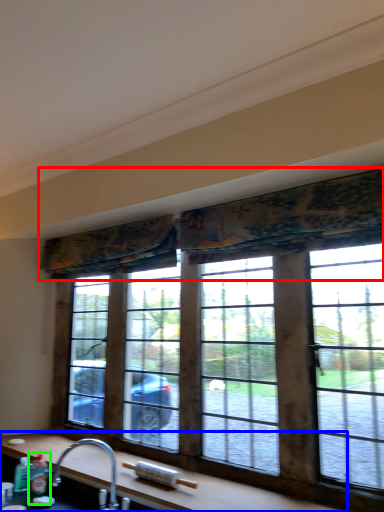
Question: Which object is the farthest from curtain (highlighted by a red box)? Choose among these: counter top (highlighted by a blue box) or bottle (highlighted by a green box).

Choices:
 (A) counter top
 (B) bottle

Answer: (B)